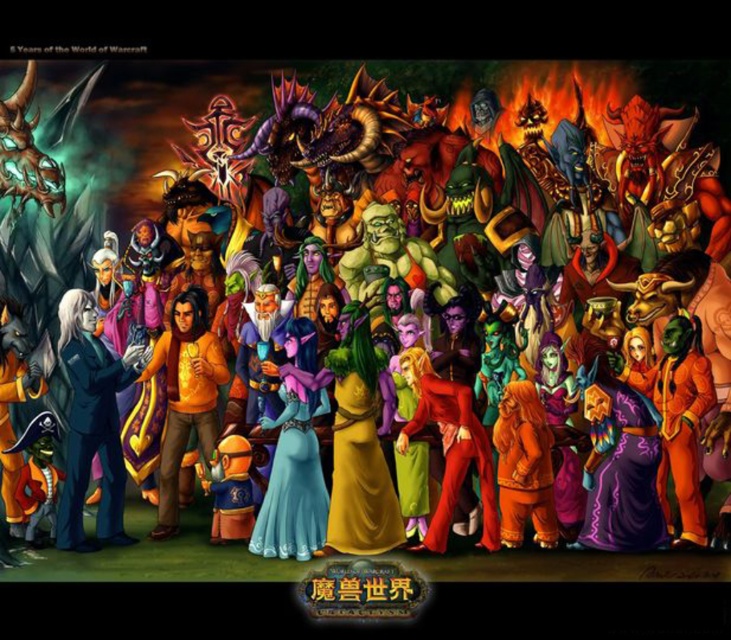
Is the position of smooth blue suit at left less distant than that of shiny red suit at center?

No.

Does point (90, 369) come farther from viewer compared to point (452, 403)?

That is True.

Locate an element on the screen. The height and width of the screenshot is (640, 731). smooth blue suit at left is located at coordinates (91, 424).

Is point (208, 374) positioned after point (443, 465)?

Yes.

Can you confirm if orange cotton sweater at center is smaller than shiny red suit at center?

Incorrect, orange cotton sweater at center is not smaller in size than shiny red suit at center.

The width and height of the screenshot is (731, 640). What do you see at coordinates (185, 396) in the screenshot? I see `orange cotton sweater at center` at bounding box center [185, 396].

You are a GUI agent. You are given a task and a screenshot of the screen. Output one action in this format:
    pyautogui.click(x=<x>, y=<y>)
    Task: Click on the orange cotton sweater at center
    
    Given the screenshot: What is the action you would take?
    pyautogui.click(x=185, y=396)

Describe the element at coordinates (91, 424) in the screenshot. I see `smooth blue suit at left` at that location.

You are a GUI agent. You are given a task and a screenshot of the screen. Output one action in this format:
    pyautogui.click(x=<x>, y=<y>)
    Task: Click on the smooth blue suit at left
    The image size is (731, 640).
    Given the screenshot: What is the action you would take?
    pyautogui.click(x=91, y=424)

Find the location of a particular element. smooth blue suit at left is located at coordinates (91, 424).